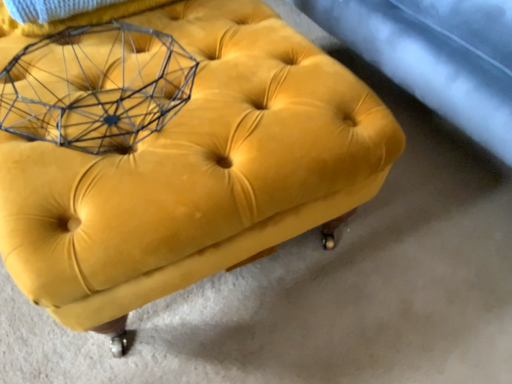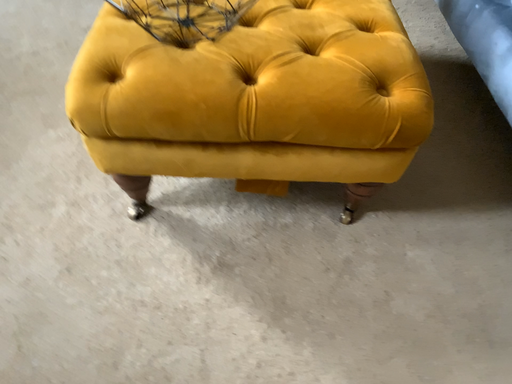
Question: How did the camera likely rotate when shooting the video?

Choices:
 (A) rotated left
 (B) rotated right

Answer: (A)